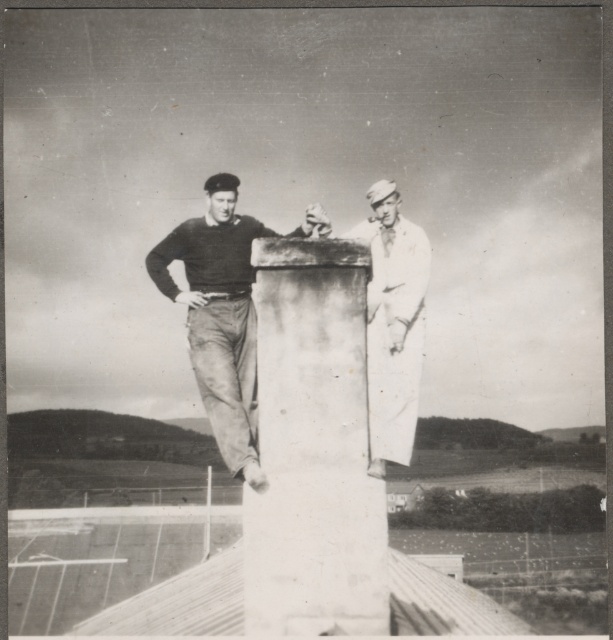
You are a photographer trying to capture both the dark gray sweater at center and the white clothed sailor at right in a single frame. Based on their heights, which one should you position closer to the camera to ensure both appear equally tall in the photo?

The dark gray sweater at center is much taller than the white clothed sailor at right, so to make them appear equally tall in the photo, position the white clothed sailor at right closer to the camera.

You are a photographer trying to capture both the white stone pillar at center and the dark gray sweater at center in a single frame. Given their sizes, which object should you focus on first to ensure both are clearly visible in your photo?

The white stone pillar at center is larger than the dark gray sweater at center, so focusing on the pillar first will help ensure both objects are clearly visible in the photo.